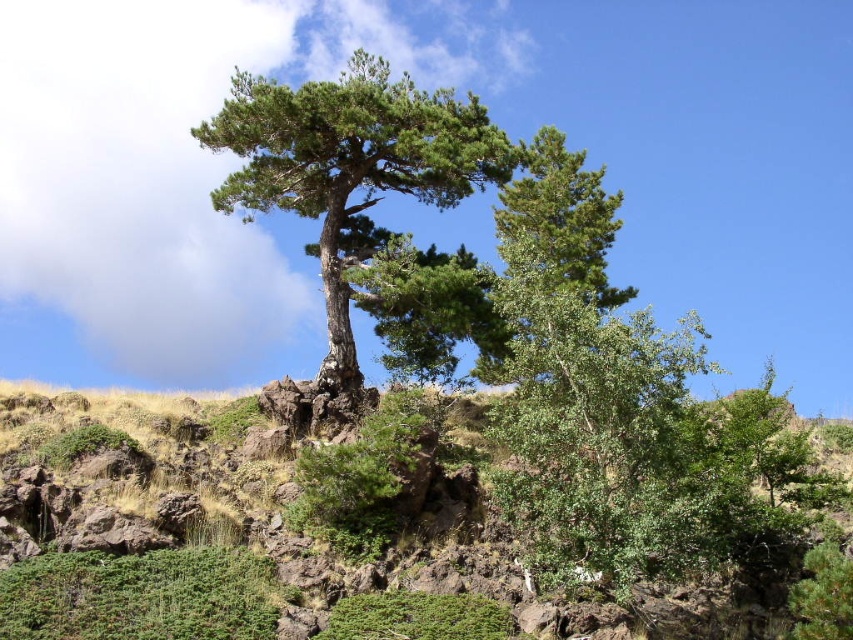
Based on the photo, you are standing in the rugged landscape and want to walk from the green textured tree at center to the green leafy shrubs at center. Which direction should you face before taking a step?

You should face to the right because the green leafy shrubs at center is located to the right of the green textured tree at center.

In the scene shown: You are standing in the rugged landscape and want to place a small marker at either point. Which point, point (799, 604) or point (289, 204), is closer to you?

Point (799, 604) is closer to the viewer than point (289, 204).